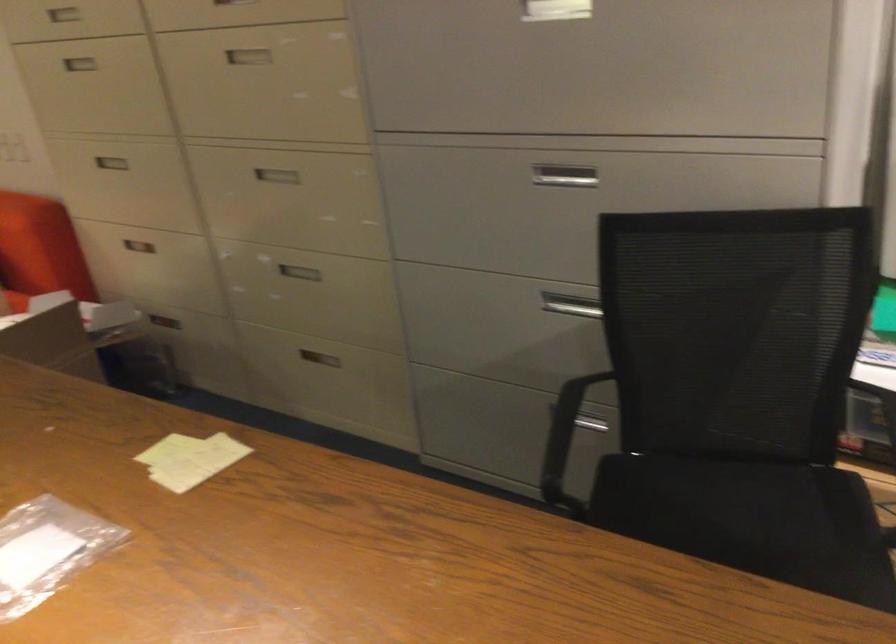
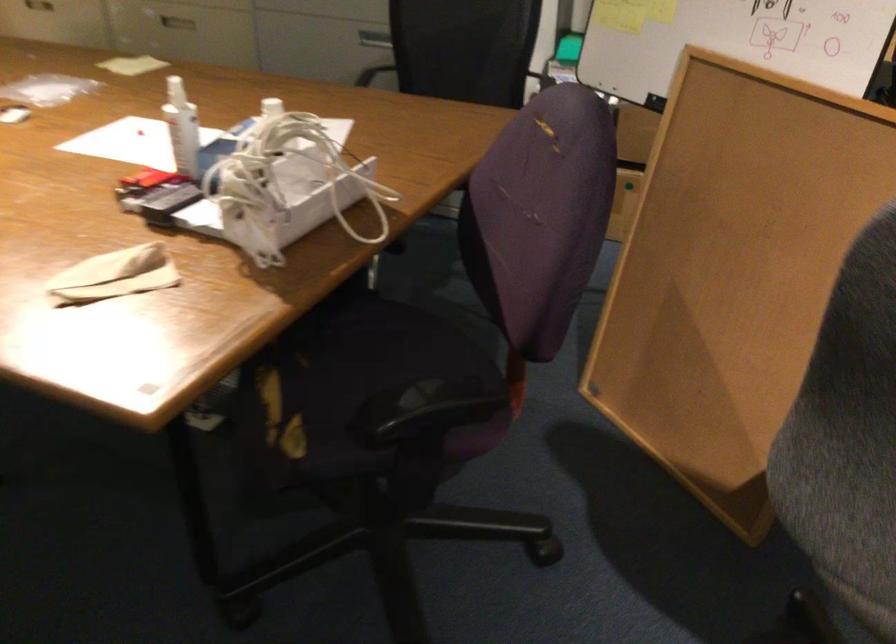
Locate, in the second image, the point that corresponds to point 312,263 in the first image.

(177, 19)